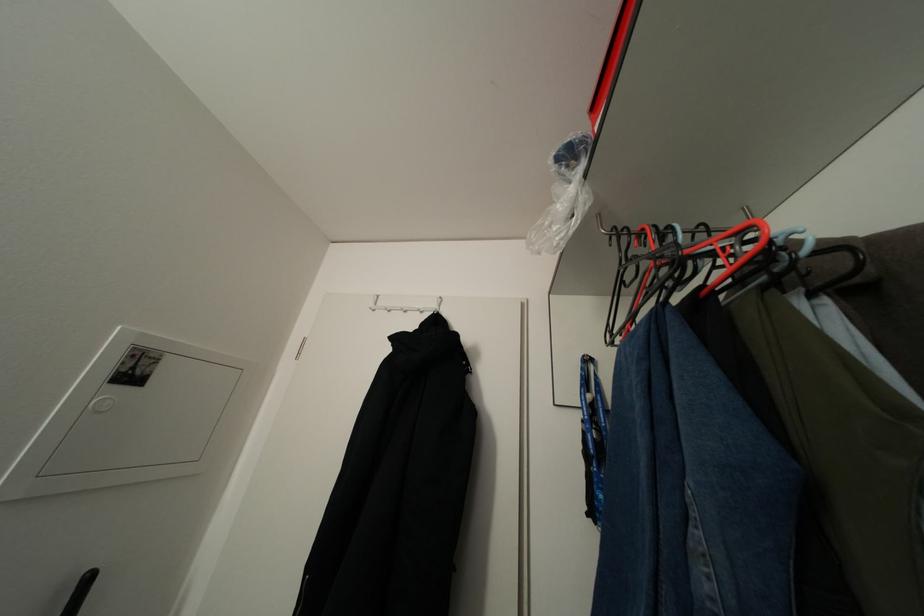
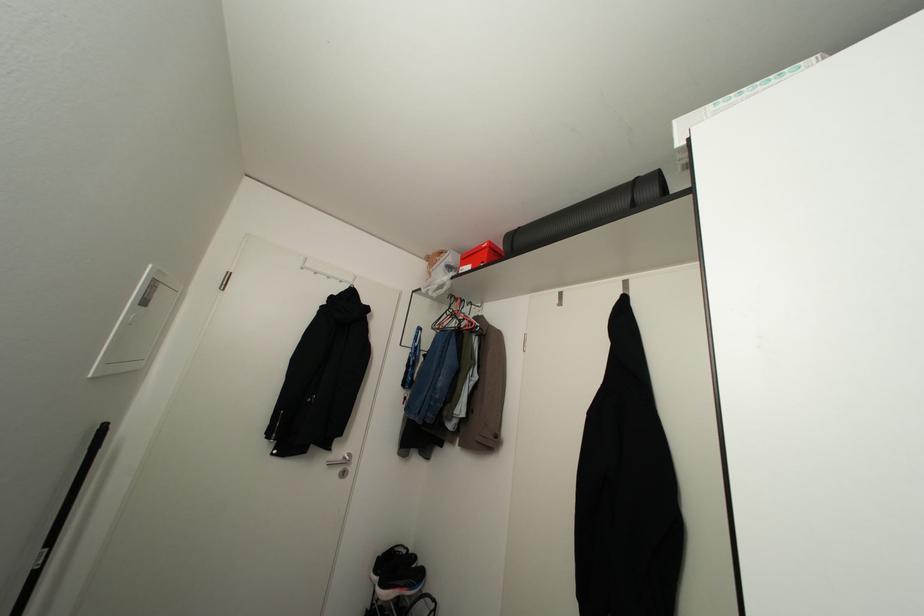
Locate, in the second image, the point that corresponds to the point at 616,232 in the first image.

(451, 294)